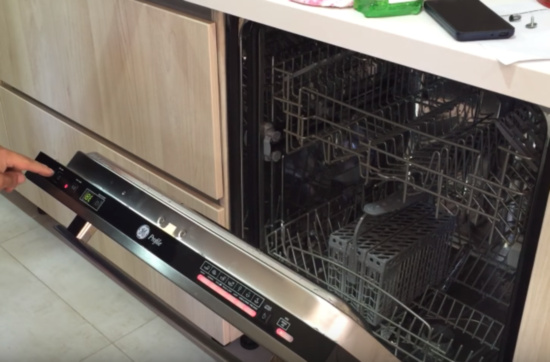
Identify the location of the top dishwasher rack. (412, 129).